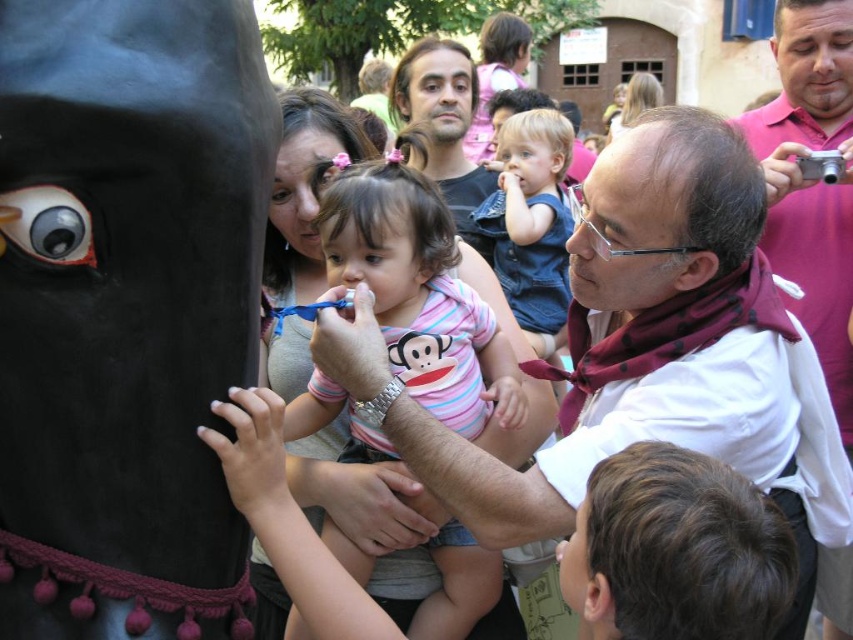
Is striped cotton onesie at center shorter than matte black shirt at center?

Indeed, striped cotton onesie at center has a lesser height compared to matte black shirt at center.

Is striped cotton onesie at center below matte black shirt at center?

Indeed, striped cotton onesie at center is positioned under matte black shirt at center.

Locate an element on the screen. This screenshot has height=640, width=853. striped cotton onesie at center is located at coordinates (419, 294).

You are a GUI agent. You are given a task and a screenshot of the screen. Output one action in this format:
    pyautogui.click(x=<x>, y=<y>)
    Task: Click on the white shirt at center
    Image resolution: width=853 pixels, height=640 pixels.
    Given the screenshot: What is the action you would take?
    pyautogui.click(x=619, y=337)

Is white shirt at center to the left of striped cotton onesie at center from the viewer's perspective?

In fact, white shirt at center is to the right of striped cotton onesie at center.

Where is `white shirt at center`? white shirt at center is located at coordinates (619, 337).

Is white shirt at center below denim shirt at center?

Indeed, white shirt at center is positioned under denim shirt at center.

Does point (699, 428) come behind point (552, 285)?

No, it is not.

The width and height of the screenshot is (853, 640). Describe the element at coordinates (619, 337) in the screenshot. I see `white shirt at center` at that location.

This screenshot has width=853, height=640. Identify the location of white shirt at center. (619, 337).